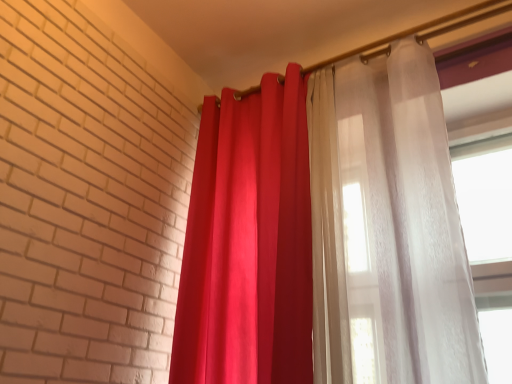
Question: Which direction should I rotate to look at matte red curtain at center, acting as the 2th curtain starting from the right?

Choices:
 (A) right
 (B) left

Answer: (B)

Question: From the image's perspective, would you say sheer white curtain at right, which appears as the 2th curtain when viewed from the left, is shown under matte red curtain at center, which is counted as the first curtain, starting from the left?

Choices:
 (A) yes
 (B) no

Answer: (B)

Question: Is sheer white curtain at right, which is the first curtain in right-to-left order, located outside matte red curtain at center, which is counted as the first curtain, starting from the left?

Choices:
 (A) yes
 (B) no

Answer: (A)

Question: Can matte red curtain at center, acting as the 2th curtain starting from the right, be found inside sheer white curtain at right, which appears as the 2th curtain when viewed from the left?

Choices:
 (A) yes
 (B) no

Answer: (B)

Question: Does sheer white curtain at right, which appears as the 2th curtain when viewed from the left, lie in front of matte red curtain at center, acting as the 2th curtain starting from the right?

Choices:
 (A) no
 (B) yes

Answer: (B)

Question: Is sheer white curtain at right, which appears as the 2th curtain when viewed from the left, shorter than matte red curtain at center, acting as the 2th curtain starting from the right?

Choices:
 (A) yes
 (B) no

Answer: (A)

Question: Are sheer white curtain at right, which is the first curtain in right-to-left order, and matte red curtain at center, which is counted as the first curtain, starting from the left, located far from each other?

Choices:
 (A) yes
 (B) no

Answer: (B)

Question: Does matte red curtain at center, which is counted as the first curtain, starting from the left, have a greater width compared to sheer white curtain at right, which is the first curtain in right-to-left order?

Choices:
 (A) no
 (B) yes

Answer: (B)

Question: Can you confirm if matte red curtain at center, which is counted as the first curtain, starting from the left, is positioned to the left of sheer white curtain at right, which appears as the 2th curtain when viewed from the left?

Choices:
 (A) yes
 (B) no

Answer: (A)

Question: Can you confirm if matte red curtain at center, which is counted as the first curtain, starting from the left, is shorter than sheer white curtain at right, which appears as the 2th curtain when viewed from the left?

Choices:
 (A) no
 (B) yes

Answer: (A)

Question: Considering the relative sizes of matte red curtain at center, acting as the 2th curtain starting from the right, and sheer white curtain at right, which is the first curtain in right-to-left order, in the image provided, is matte red curtain at center, acting as the 2th curtain starting from the right, thinner than sheer white curtain at right, which is the first curtain in right-to-left order,?

Choices:
 (A) yes
 (B) no

Answer: (B)

Question: Can we say matte red curtain at center, acting as the 2th curtain starting from the right, lies outside sheer white curtain at right, which appears as the 2th curtain when viewed from the left?

Choices:
 (A) no
 (B) yes

Answer: (B)

Question: Can you confirm if matte red curtain at center, which is counted as the first curtain, starting from the left, is bigger than sheer white curtain at right, which is the first curtain in right-to-left order?

Choices:
 (A) yes
 (B) no

Answer: (A)

Question: Considering the positions of point (222, 182) and point (270, 206), is point (222, 182) closer or farther from the camera than point (270, 206)?

Choices:
 (A) farther
 (B) closer

Answer: (A)